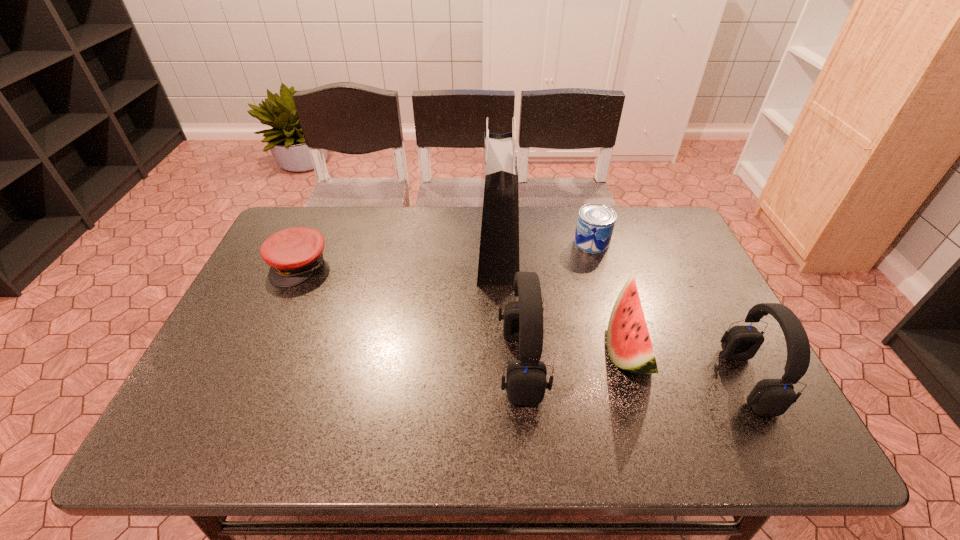
Locate an element on the screen. vacant area situated 0.400m on the outer rind of the fourth tallest object is located at coordinates (442, 349).

At what (x,y) coordinates should I click in order to perform the action: click on free space located on the outer rind of the fourth tallest object. Please return your answer as a coordinate pair (x, y). The width and height of the screenshot is (960, 540). Looking at the image, I should click on click(x=564, y=349).

Find the location of a particular element. The width and height of the screenshot is (960, 540). can present at the far edge is located at coordinates (595, 224).

Identify the location of shopping bag at the far edge. (498, 216).

Locate an element on the screen. cap present at the far edge is located at coordinates (293, 254).

You are a GUI agent. You are given a task and a screenshot of the screen. Output one action in this format:
    pyautogui.click(x=<x>, y=<y>)
    Task: Click on the watermelon that is at the near edge
    
    Given the screenshot: What is the action you would take?
    pyautogui.click(x=629, y=345)

In order to click on object that is at the left edge in this screenshot , I will do `click(293, 254)`.

Identify the location of object that is positioned at the right edge. The height and width of the screenshot is (540, 960). (770, 397).

Identify the location of object located in the far left corner section of the desktop. This screenshot has width=960, height=540. (293, 254).

At what (x,y) coordinates should I click in order to perform the action: click on object that is at the near right corner. Please return your answer as a coordinate pair (x, y). Looking at the image, I should click on (770, 397).